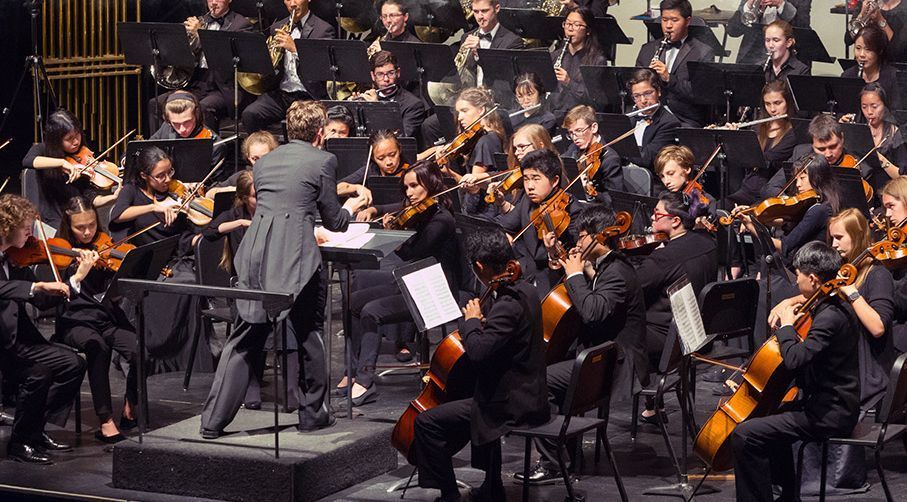
In order to click on black chair in this screenshot , I will do `click(598, 384)`, `click(670, 350)`, `click(722, 307)`, `click(894, 413)`, `click(27, 181)`, `click(639, 184)`.